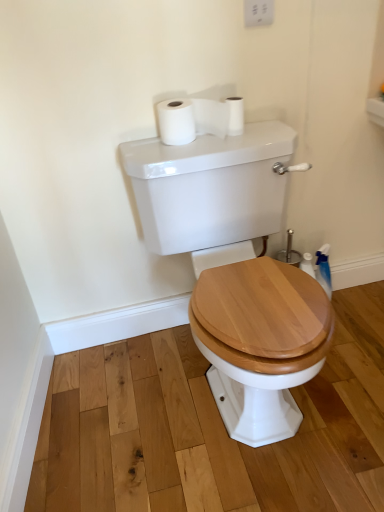
The image size is (384, 512). Find the location of `free space that is to the left of white matte toilet paper at upper center, placed as the 1th toilet paper when sorted from right to left`. free space that is to the left of white matte toilet paper at upper center, placed as the 1th toilet paper when sorted from right to left is located at coordinates (186, 141).